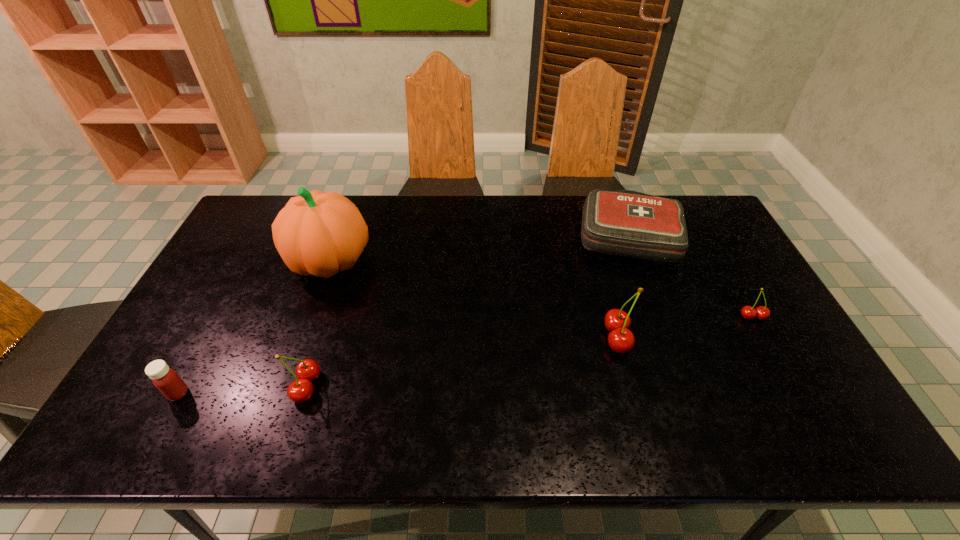
Image resolution: width=960 pixels, height=540 pixels. I want to click on the second shortest cherry, so click(299, 391).

This screenshot has width=960, height=540. What are the coordinates of `the nearest cherry` in the screenshot? It's located at tap(299, 391).

At what (x,y) coordinates should I click in order to perform the action: click on the second cherry from left to right. Please return your answer as a coordinate pair (x, y). Looking at the image, I should click on (620, 339).

Locate an element on the screen. Image resolution: width=960 pixels, height=540 pixels. the rightmost object is located at coordinates (748, 312).

Locate an element on the screen. This screenshot has width=960, height=540. the rightmost cherry is located at coordinates (748, 312).

Find the location of a particular element. Image resolution: width=960 pixels, height=540 pixels. the tallest object is located at coordinates pyautogui.click(x=317, y=233).

You are a GUI agent. You are given a task and a screenshot of the screen. Output one action in this format:
    pyautogui.click(x=<x>, y=<y>)
    Task: Click on the first-aid kit
    This screenshot has height=540, width=960.
    Given the screenshot: What is the action you would take?
    pyautogui.click(x=627, y=223)

Locate an element on the screen. The width and height of the screenshot is (960, 540). medicine is located at coordinates (166, 380).

Find the location of a particular element. The height and width of the screenshot is (540, 960). vacant region located with the stems of the leftmost cherry pointing upwards is located at coordinates (360, 386).

Identify the location of vacant position located 0.050m with the stems of the second cherry from left to right pointing upwards. 586,338.